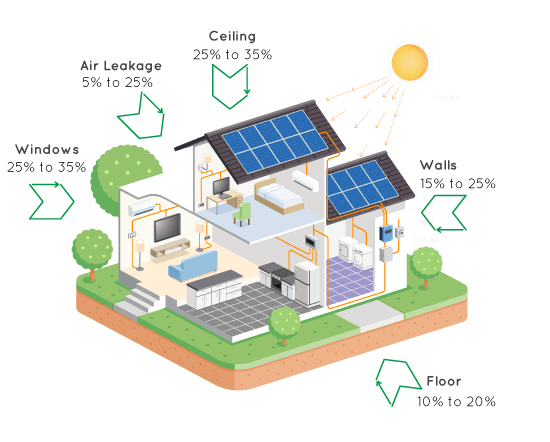
You are a GUI agent. You are given a task and a screenshot of the screen. Output one action in this format:
    pyautogui.click(x=<x>, y=<y>)
    Task: Click on the monitor
    The width and height of the screenshot is (550, 442).
    Given the screenshot: What is the action you would take?
    pyautogui.click(x=225, y=188), pyautogui.click(x=165, y=237)